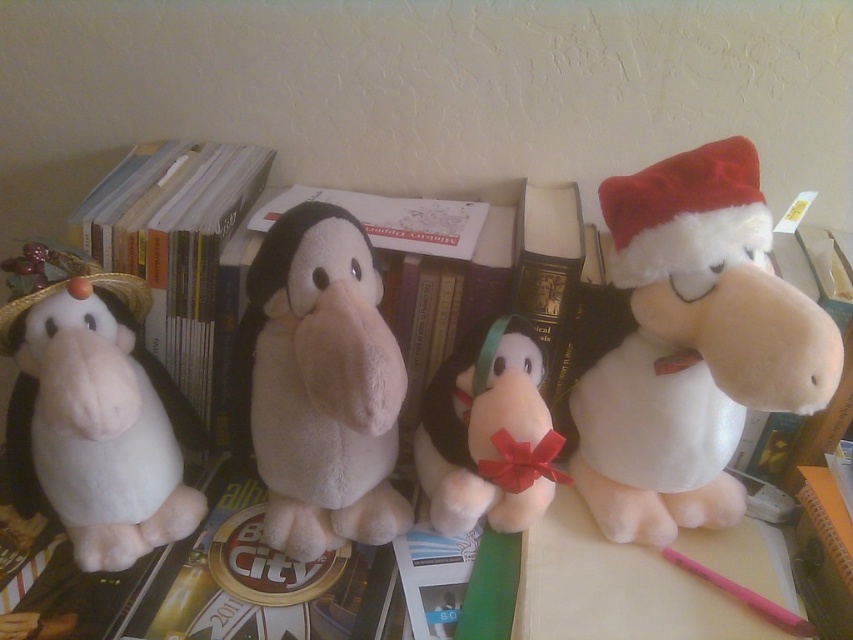
Question: Considering the real-world distances, which object is farthest from the white plush toy at upper right?

Choices:
 (A) white plush penguin at center
 (B) white paper book at left
 (C) white plush toy at center
 (D) white plush hippo at left

Answer: (D)

Question: Which of the following is the closest to the observer?

Choices:
 (A) white plush toy at center
 (B) white plush hippo at left

Answer: (B)

Question: Is white plush toy at upper right to the left of white paper book at left from the viewer's perspective?

Choices:
 (A) yes
 (B) no

Answer: (B)

Question: Can you confirm if white plush hippo at left is positioned to the left of white plush toy at center?

Choices:
 (A) no
 (B) yes

Answer: (B)

Question: Can you confirm if white plush hippo at left is bigger than white paper book at left?

Choices:
 (A) yes
 (B) no

Answer: (A)

Question: Estimate the real-world distances between objects in this image. Which object is closer to the white plush toy at upper right?

Choices:
 (A) white plush penguin at center
 (B) white paper book at left
 (C) white plush hippo at left

Answer: (A)